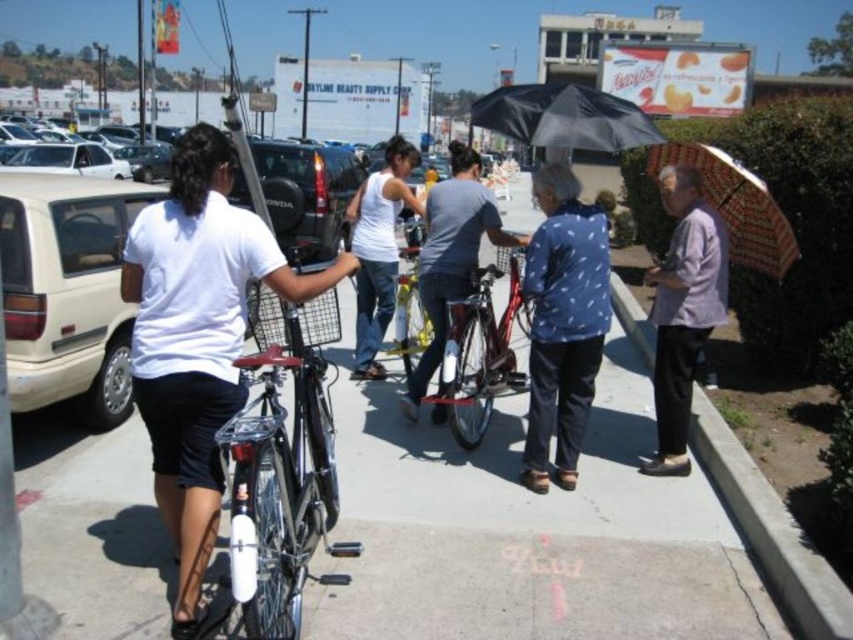
Who is more distant from viewer, (595, 433) or (593, 138)?

Point (595, 433)

Who is lower down, concrete sidewalk at center or black matte umbrella at upper center?

Positioned lower is concrete sidewalk at center.

Is point (112, 460) less distant than point (543, 136)?

No, (112, 460) is behind (543, 136).

Locate an element on the screen. concrete sidewalk at center is located at coordinates (549, 528).

Does concrete at right appear on the right side of shiny metallic bicycle at center?

Yes, concrete at right is to the right of shiny metallic bicycle at center.

Does point (758, 536) come behind point (469, 388)?

No, (758, 536) is closer to viewer.

Image resolution: width=853 pixels, height=640 pixels. In order to click on concrete at right in this screenshot , I will do `click(770, 531)`.

Looking at this image, measure the distance between point (26,548) and camera.

The distance of point (26,548) from camera is 3.89 meters.

Is concrete sidewalk at center further to the viewer compared to concrete at right?

Yes, concrete sidewalk at center is further from the viewer.

Is point (71, 528) behind point (801, 582)?

Yes, point (71, 528) is farther from viewer.

Image resolution: width=853 pixels, height=640 pixels. In order to click on concrete sidewalk at center in this screenshot , I will do `click(549, 528)`.